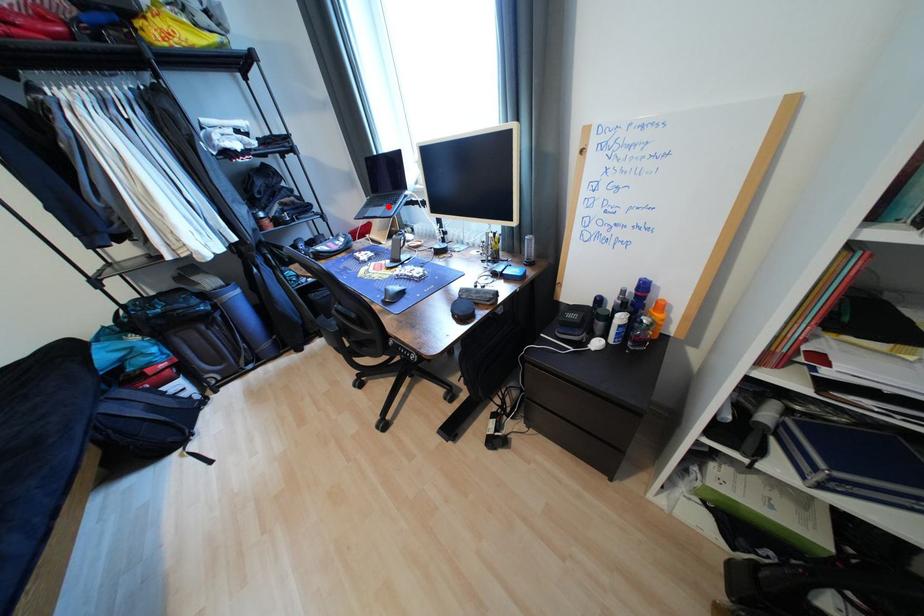
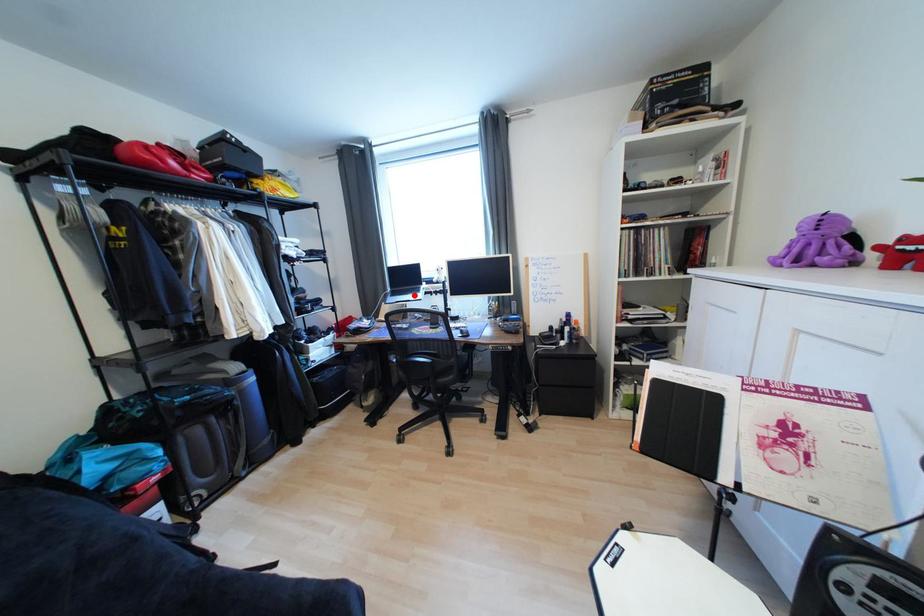
I am providing you with two images of the same scene from different viewpoints. A red point is marked on the first image and another point is marked on the second image. Is the red point in image1 aligned with the point shown in image2?

Yes